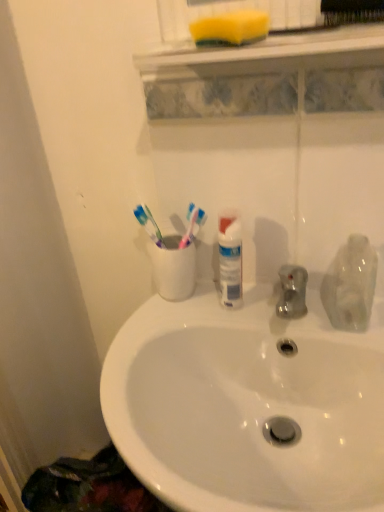
The image size is (384, 512). Find the location of `free space above yellow sponge at upper center (from a real-world perspective)`. free space above yellow sponge at upper center (from a real-world perspective) is located at coordinates (295, 30).